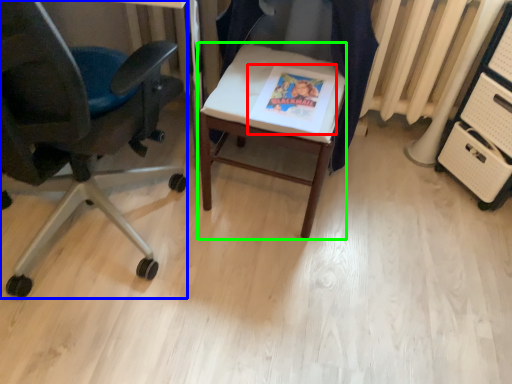
Question: Based on their relative distances, which object is farther from magazine (highlighted by a red box)? Choose from chair (highlighted by a blue box) and desk (highlighted by a green box).

Choices:
 (A) chair
 (B) desk

Answer: (A)